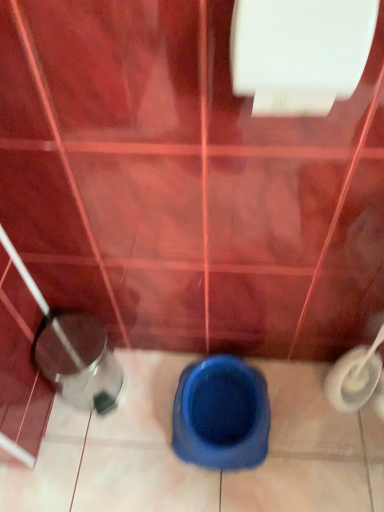
Question: Which is correct: white glossy toilet paper at upper center is inside shiny metallic potty at lower left, or outside of it?

Choices:
 (A) inside
 (B) outside

Answer: (B)

Question: Is white glossy toilet paper at upper center wider or thinner than shiny metallic potty at lower left?

Choices:
 (A) wide
 (B) thin

Answer: (B)

Question: Estimate the real-world distances between objects in this image. Which object is closer to the blue rubber toilet at center?

Choices:
 (A) white glossy toilet paper at upper center
 (B) shiny metallic potty at lower left

Answer: (B)

Question: Estimate the real-world distances between objects in this image. Which object is closer to the white glossy toilet paper at upper center?

Choices:
 (A) shiny metallic potty at lower left
 (B) blue rubber toilet at center

Answer: (A)